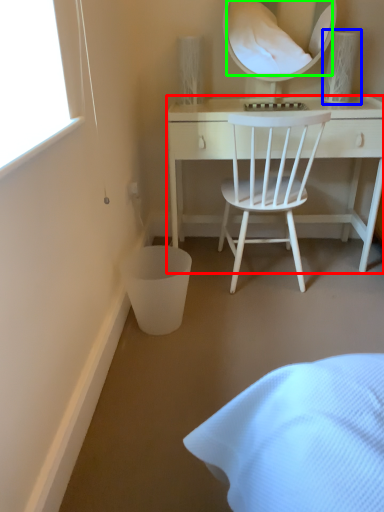
Question: Which object is positioned farthest from desk (highlighted by a red box)? Select from table lamp (highlighted by a blue box) and mirror (highlighted by a green box).

Choices:
 (A) table lamp
 (B) mirror

Answer: (B)